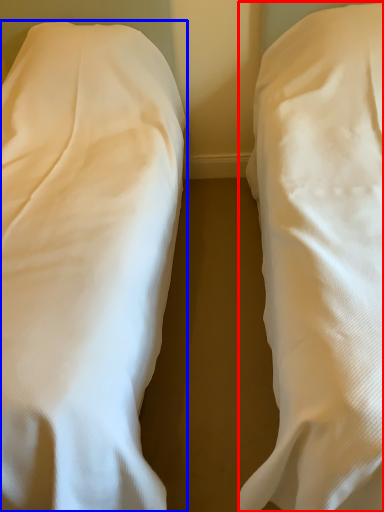
Question: Which point is further to the camera, bed (highlighted by a red box) or bed (highlighted by a blue box)?

Choices:
 (A) bed
 (B) bed

Answer: (B)